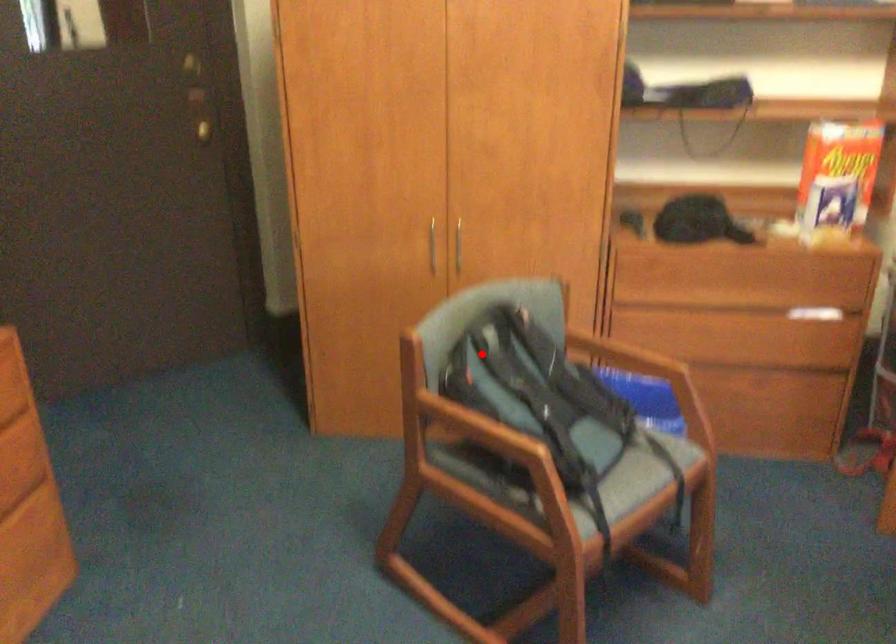
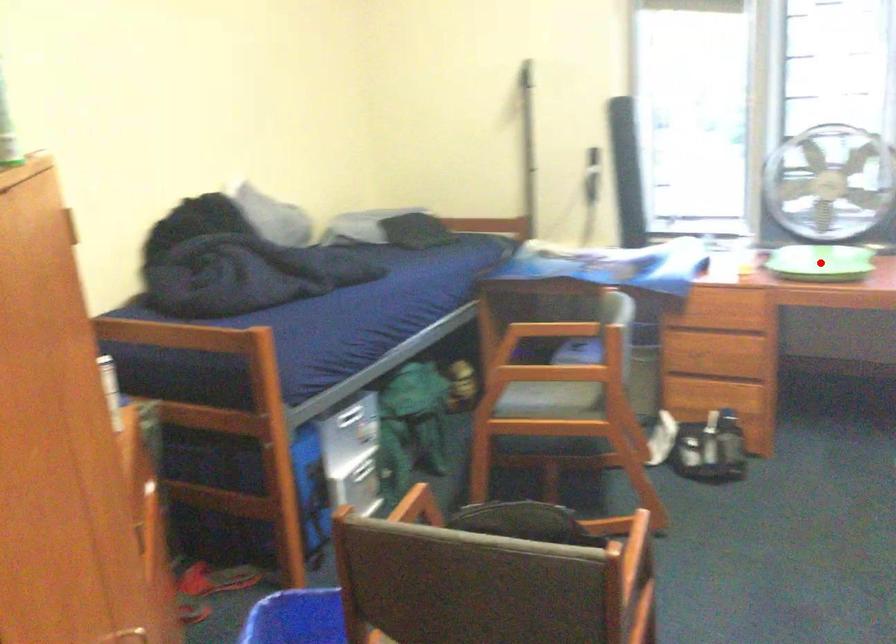
I am providing you with two images of the same scene from different viewpoints. A red point is marked on the first image and another point is marked on the second image. Is the marked point in image1 the same physical position as the marked point in image2?

No